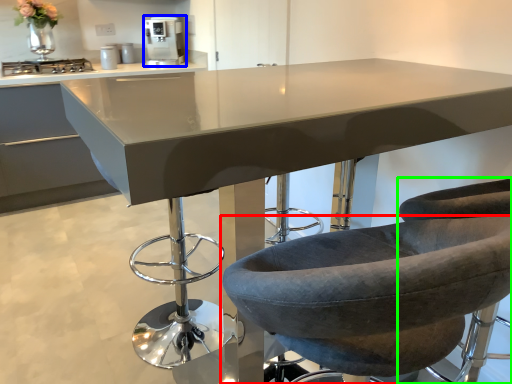
Question: Which object is the closest to the chair (highlighted by a red box)? Choose among these: home appliance (highlighted by a blue box) or chair (highlighted by a green box).

Choices:
 (A) home appliance
 (B) chair

Answer: (B)